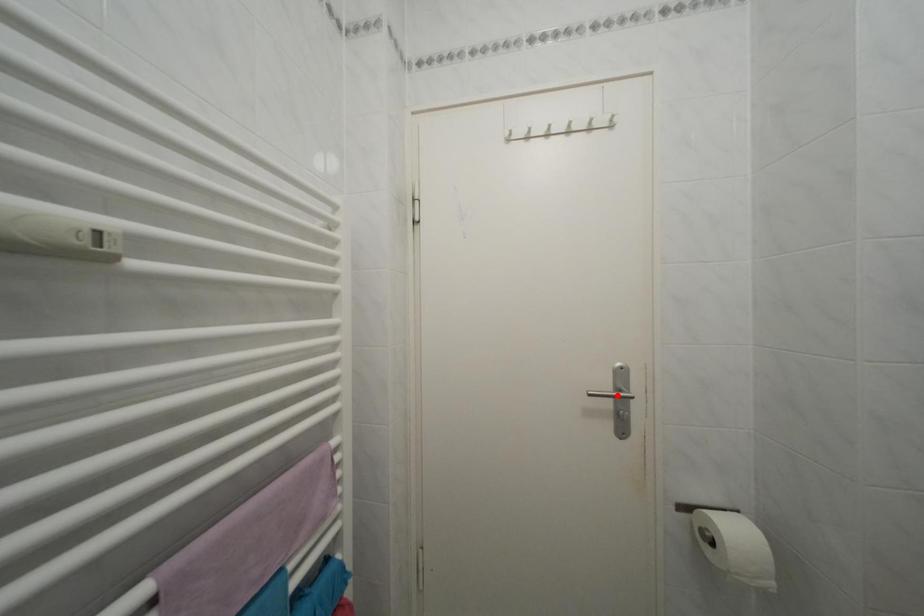
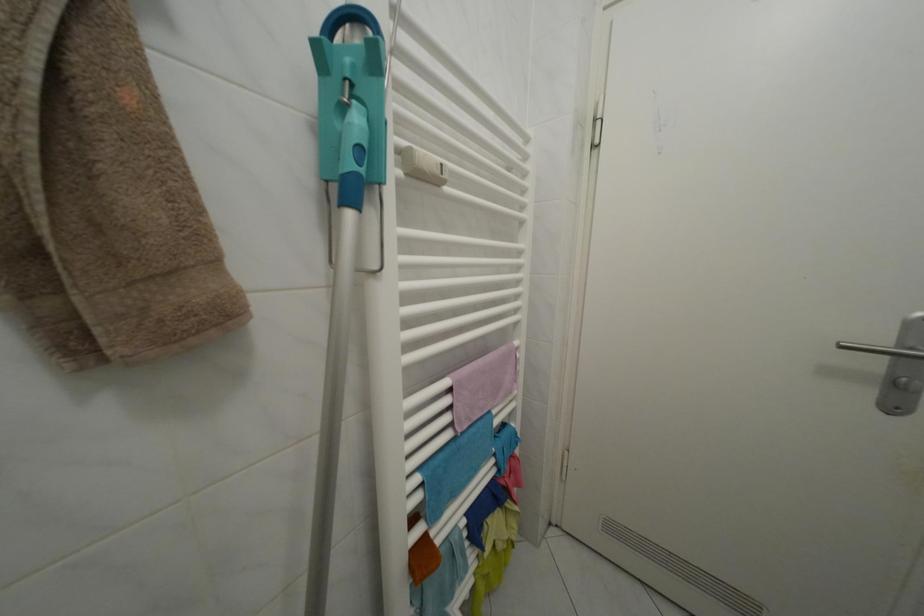
Locate, in the second image, the point that corresponds to the highlighted location in the first image.

(892, 350)